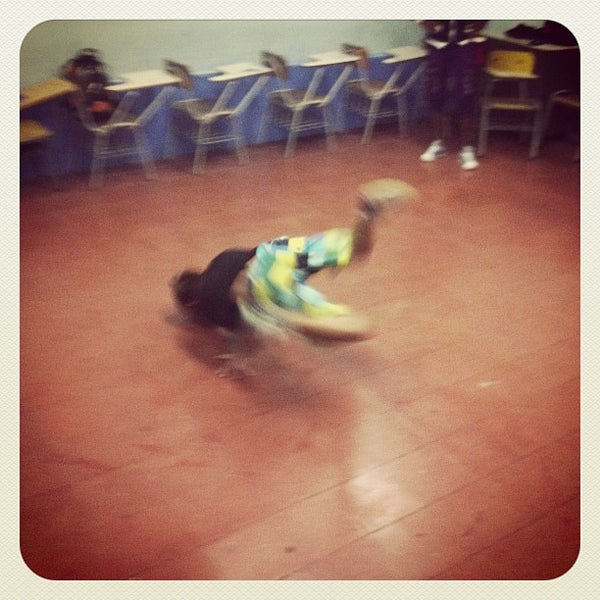
At what (x,y) coordinates should I click in order to perform the action: click on floor. Please return your answer as a coordinate pair (x, y). This screenshot has width=600, height=600. Looking at the image, I should click on (430, 402).